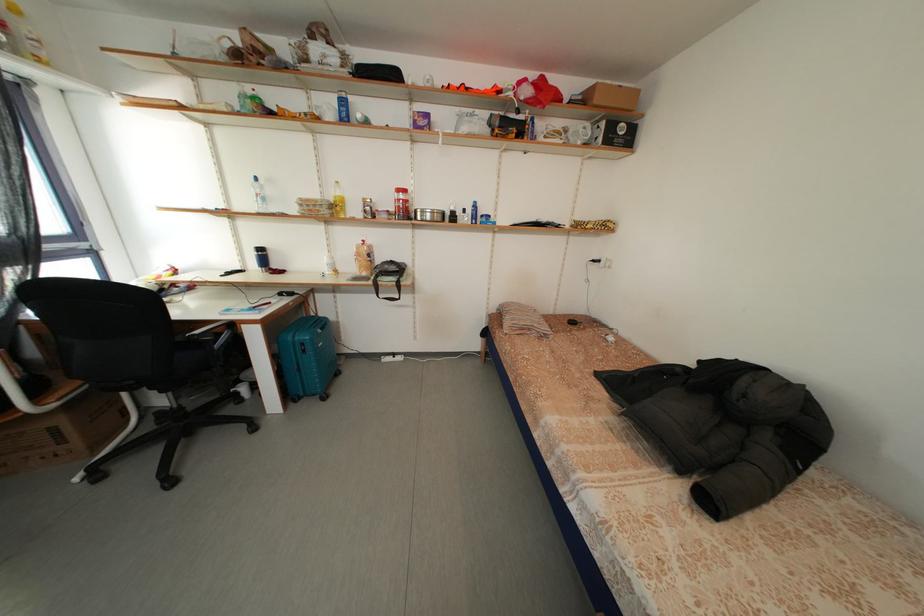
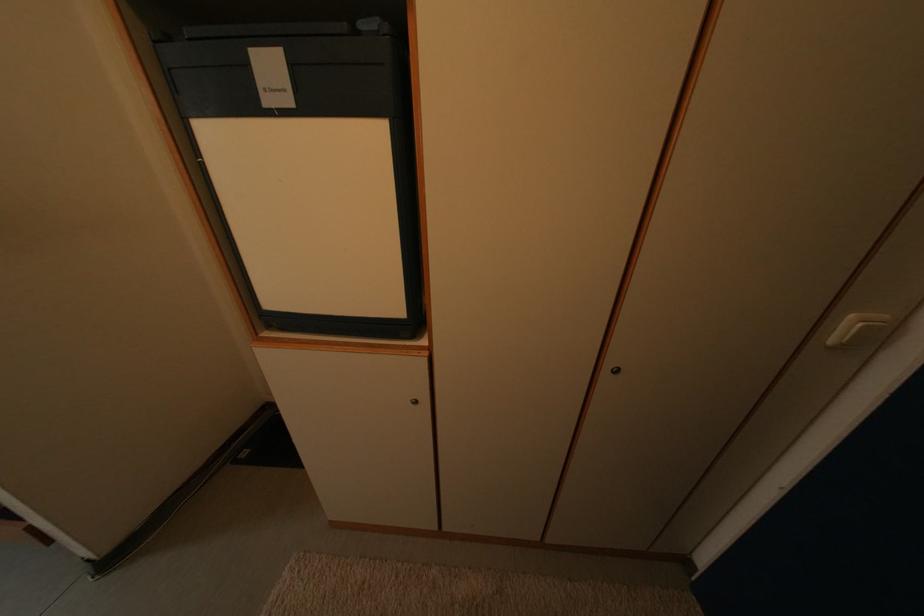
Question: What movement of the cameraman would produce the second image?

Choices:
 (A) Left
 (B) Right
 (C) Forward
 (D) Backward

Answer: (B)